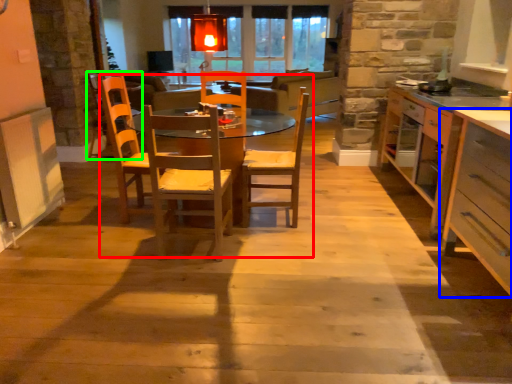
Question: Based on their relative distances, which object is nearer to kitchen & dining room table (highlighted by a red box)? Choose from cabinetry (highlighted by a blue box) and armchair (highlighted by a green box).

Choices:
 (A) cabinetry
 (B) armchair

Answer: (A)